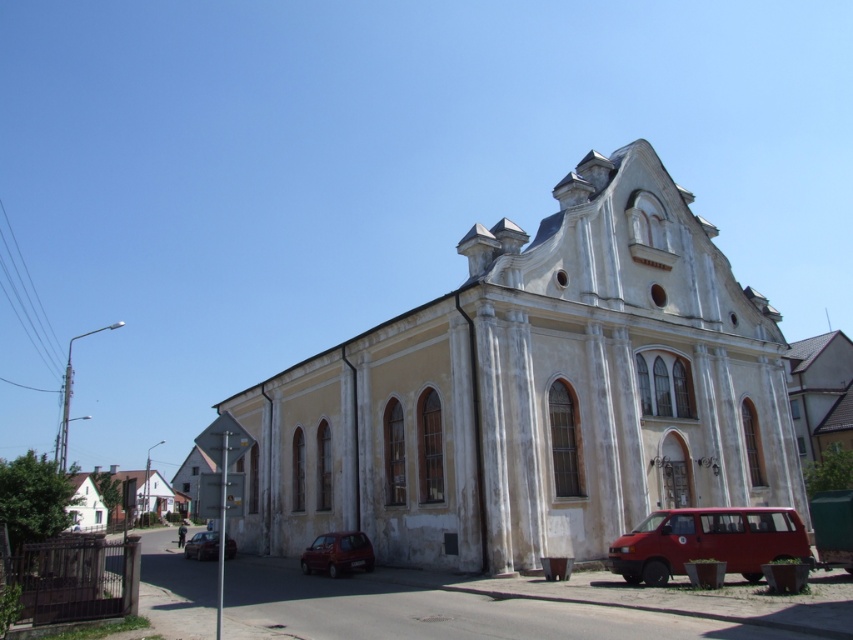
You are a pedestrian standing in front of the white stone church at center. You want to walk to the matte red car at lower center. Which direction should you go to reach the car?

The white stone church at center is in front of the matte red car at lower center, so you should walk backward to reach the matte red car at lower center.

Based on the photo, you are a photographer standing in front of the white stone church at center and the matte red van at lower right. You want to capture a photo that includes both objects. Which object should you position closer to the left side of the frame to include both in the photo?

The white stone church at center is positioned on the left side of the matte red van at lower right, so to include both in the photo, you should position the white stone church at center closer to the left side of the frame.

You are a delivery driver who needs to park your matte red car at lower center as close as possible to the white stone church at center without blocking the entrance. The parking space must be at least 2 meters away from the church. Can you park your car within the required distance?

The white stone church at center is 13.95 meters from the matte red car at lower center. Since the required minimum distance is 2 meters, the car can be parked closer than the current 13.95 meters to meet the requirement.